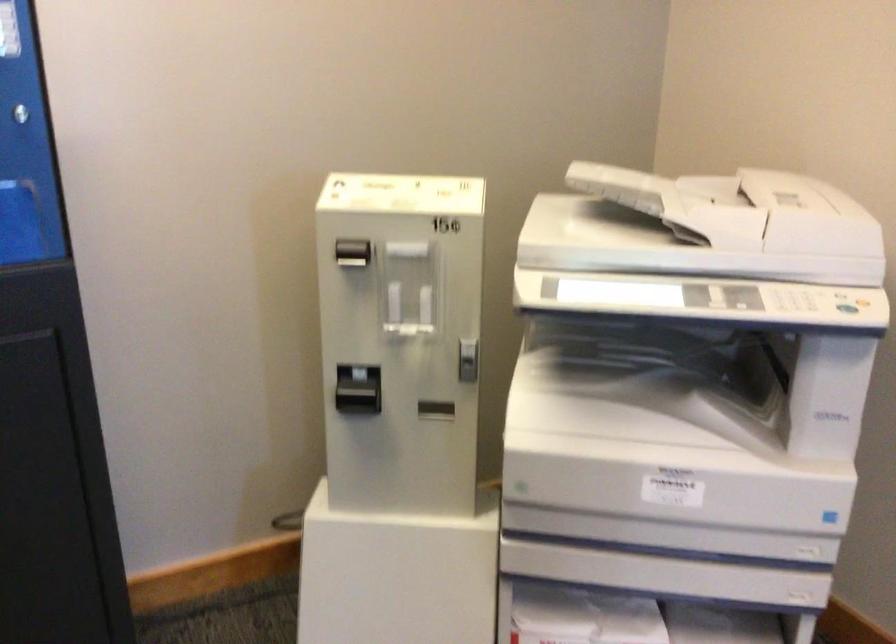
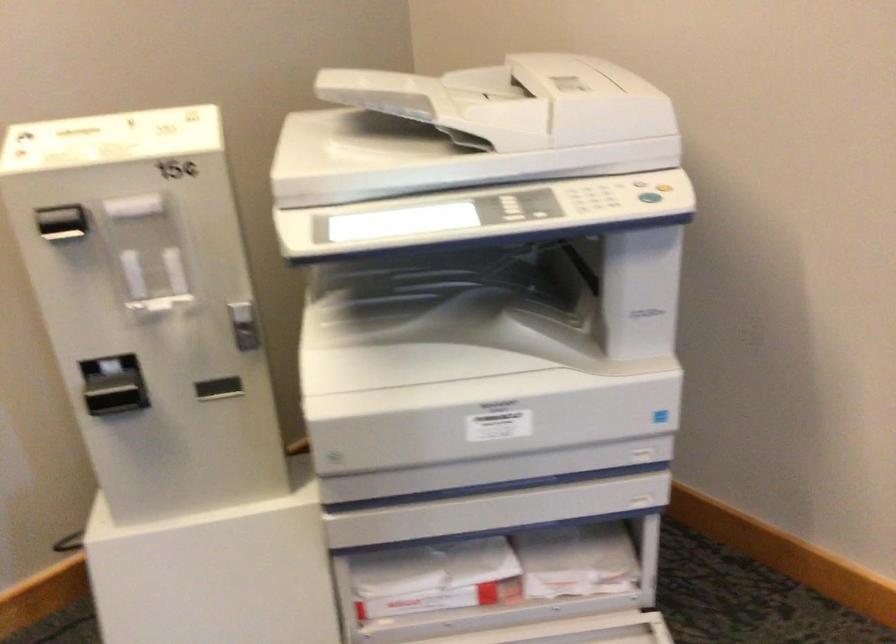
In the second image, find the point that corresponds to the point at 346,254 in the first image.

(62, 223)